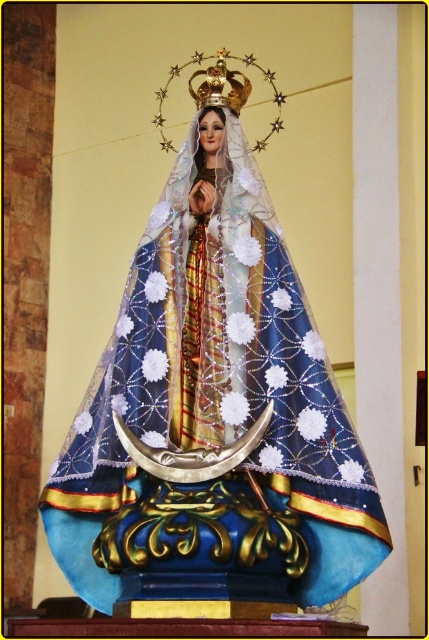
Based on the photo, you are an art conservator examining the religious statue. You need to determine the order in which to clean the blue fabric statue at center and the gold metallic crown at upper center, starting with the part nearest to you. Which object should you clean first?

The blue fabric statue at center is closer to the viewer than the gold metallic crown at upper center, so you should start by cleaning the blue fabric statue at center first.

You are standing in front of a religious statue in a sacred space. You notice the blue fabric statue at center and the gold metallic crown at upper center. Which object is positioned to the right side of the other?

The gold metallic crown at upper center is to the right of the blue fabric statue at center.